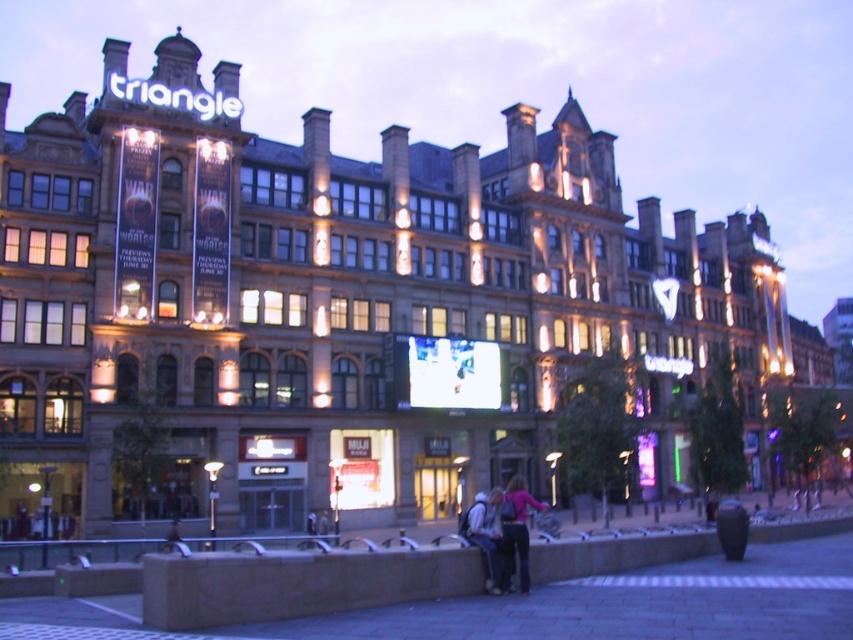
Does dark pink sweater at lower center have a larger size compared to denim jacket at lower center?

Yes, dark pink sweater at lower center is bigger than denim jacket at lower center.

Between point (509, 509) and point (486, 588), which one is positioned in front?

Point (486, 588)

You are a GUI agent. You are given a task and a screenshot of the screen. Output one action in this format:
    pyautogui.click(x=<x>, y=<y>)
    Task: Click on the dark pink sweater at lower center
    The width and height of the screenshot is (853, 640).
    Given the screenshot: What is the action you would take?
    pyautogui.click(x=515, y=532)